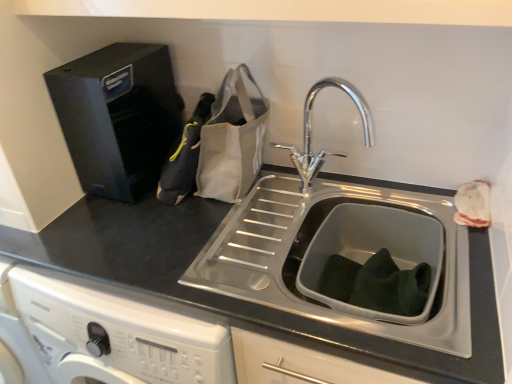
Question: Is the depth of black plastic water dispenser at upper left less than that of chrome metallic faucet at center?

Choices:
 (A) no
 (B) yes

Answer: (A)

Question: Would you say black plastic water dispenser at upper left contains chrome metallic faucet at center?

Choices:
 (A) no
 (B) yes

Answer: (A)

Question: Could you tell me if black plastic water dispenser at upper left is turned towards chrome metallic faucet at center?

Choices:
 (A) yes
 (B) no

Answer: (B)

Question: From a real-world perspective, is black plastic water dispenser at upper left located higher than chrome metallic faucet at center?

Choices:
 (A) no
 (B) yes

Answer: (B)

Question: Considering the relative positions of black plastic water dispenser at upper left and chrome metallic faucet at center in the image provided, is black plastic water dispenser at upper left to the left of chrome metallic faucet at center from the viewer's perspective?

Choices:
 (A) no
 (B) yes

Answer: (B)

Question: Considering the positions of chrome metallic faucet at center and black plastic water dispenser at upper left in the image, is chrome metallic faucet at center wider or thinner than black plastic water dispenser at upper left?

Choices:
 (A) wide
 (B) thin

Answer: (B)

Question: In the image, is chrome metallic faucet at center positioned in front of or behind black plastic water dispenser at upper left?

Choices:
 (A) behind
 (B) front

Answer: (B)

Question: Looking at the image, does chrome metallic faucet at center seem bigger or smaller compared to black plastic water dispenser at upper left?

Choices:
 (A) big
 (B) small

Answer: (B)

Question: From the image's perspective, is chrome metallic faucet at center above or below black plastic water dispenser at upper left?

Choices:
 (A) below
 (B) above

Answer: (A)

Question: Considering the positions of black matte countertop at center and black fabric bag at left in the image, is black matte countertop at center bigger or smaller than black fabric bag at left?

Choices:
 (A) small
 (B) big

Answer: (B)

Question: Is black matte countertop at center in front of or behind black fabric bag at left in the image?

Choices:
 (A) behind
 (B) front

Answer: (B)

Question: Looking at their shapes, would you say black matte countertop at center is wider or thinner than black fabric bag at left?

Choices:
 (A) thin
 (B) wide

Answer: (B)

Question: From a real-world perspective, is black matte countertop at center positioned above or below black fabric bag at left?

Choices:
 (A) above
 (B) below

Answer: (B)

Question: From the image's perspective, is black matte countertop at center located above or below chrome metallic faucet at center?

Choices:
 (A) below
 (B) above

Answer: (A)

Question: Considering the positions of point [80, 253] and point [308, 114], is point [80, 253] closer or farther from the camera than point [308, 114]?

Choices:
 (A) farther
 (B) closer

Answer: (B)